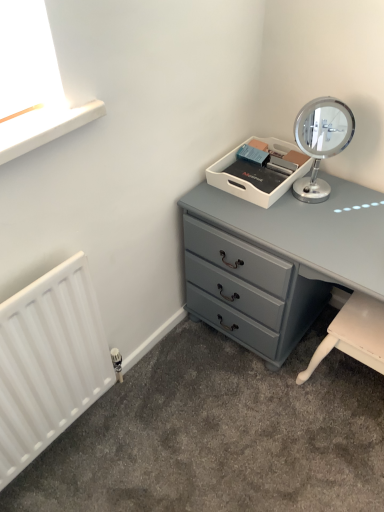
Question: Is white plastic tray at upper center located outside polished chrome mirror at upper right?

Choices:
 (A) no
 (B) yes

Answer: (B)

Question: Does white plastic tray at upper center have a greater width compared to polished chrome mirror at upper right?

Choices:
 (A) no
 (B) yes

Answer: (B)

Question: Can you confirm if white plastic tray at upper center is thinner than polished chrome mirror at upper right?

Choices:
 (A) no
 (B) yes

Answer: (A)

Question: From the image's perspective, is white plastic tray at upper center beneath polished chrome mirror at upper right?

Choices:
 (A) yes
 (B) no

Answer: (A)

Question: Can you confirm if white plastic tray at upper center is bigger than polished chrome mirror at upper right?

Choices:
 (A) no
 (B) yes

Answer: (A)

Question: In terms of height, does polished chrome mirror at upper right look taller or shorter compared to white matte radiator at lower left?

Choices:
 (A) short
 (B) tall

Answer: (A)

Question: From a real-world perspective, relative to white matte radiator at lower left, is polished chrome mirror at upper right vertically above or below?

Choices:
 (A) above
 (B) below

Answer: (A)

Question: Would you say polished chrome mirror at upper right is to the left or to the right of white matte radiator at lower left in the picture?

Choices:
 (A) right
 (B) left

Answer: (A)

Question: Relative to white matte radiator at lower left, is polished chrome mirror at upper right in front or behind?

Choices:
 (A) front
 (B) behind

Answer: (B)

Question: From a real-world perspective, is white matte radiator at lower left positioned above or below polished chrome mirror at upper right?

Choices:
 (A) above
 (B) below

Answer: (B)

Question: Relative to polished chrome mirror at upper right, is white matte radiator at lower left in front or behind?

Choices:
 (A) front
 (B) behind

Answer: (A)

Question: Does point (114, 377) appear closer or farther from the camera than point (327, 138)?

Choices:
 (A) closer
 (B) farther

Answer: (B)

Question: In terms of width, does white matte radiator at lower left look wider or thinner when compared to polished chrome mirror at upper right?

Choices:
 (A) wide
 (B) thin

Answer: (B)

Question: Considering the positions of matte gray chest of drawers at center and white plastic tray at upper center in the image, is matte gray chest of drawers at center taller or shorter than white plastic tray at upper center?

Choices:
 (A) short
 (B) tall

Answer: (B)

Question: From a real-world perspective, is matte gray chest of drawers at center physically located above or below white plastic tray at upper center?

Choices:
 (A) above
 (B) below

Answer: (B)